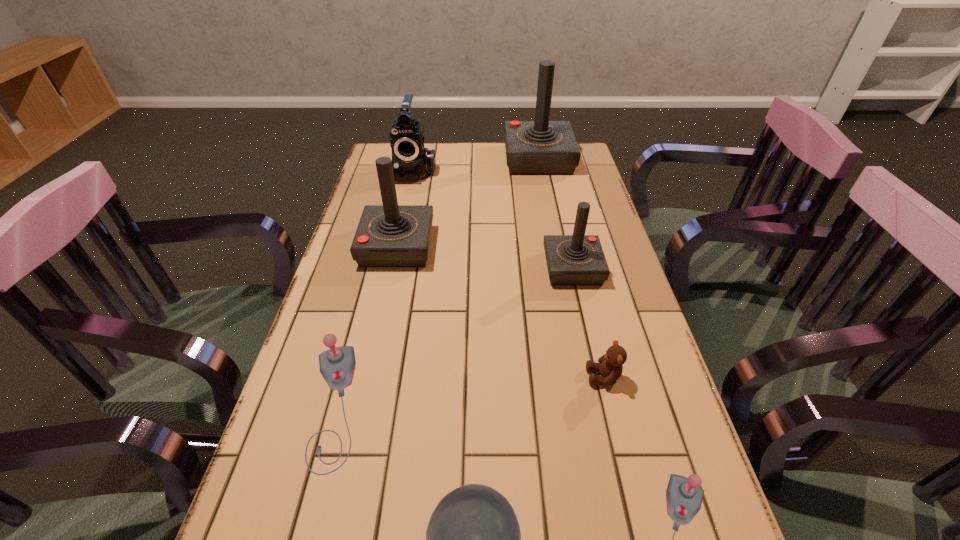
Where is `the biggest red joystick`? the biggest red joystick is located at coordinates click(541, 147).

Find the location of a particular element. The width and height of the screenshot is (960, 540). the farthest joystick is located at coordinates (541, 147).

Find the location of a particular element. the second tallest joystick is located at coordinates (390, 235).

Locate an element on the screen. the second biggest red joystick is located at coordinates (390, 235).

You are a GUI agent. You are given a task and a screenshot of the screen. Output one action in this format:
    pyautogui.click(x=<x>, y=<y>)
    Task: Click on the camcorder
    This screenshot has width=960, height=540.
    Given the screenshot: What is the action you would take?
    [x=411, y=161]

In order to click on the third tallest joystick in this screenshot , I will do `click(578, 259)`.

The width and height of the screenshot is (960, 540). What are the coordinates of `the fourth tallest object` in the screenshot? It's located at (578, 259).

At what (x,y) coordinates should I click in order to perform the action: click on the fourth tallest joystick. Please return your answer as a coordinate pair (x, y). The height and width of the screenshot is (540, 960). Looking at the image, I should click on click(337, 365).

The height and width of the screenshot is (540, 960). I want to click on the farther gray joystick, so click(x=337, y=365).

Find the location of a particular element. teddy bear is located at coordinates (610, 366).